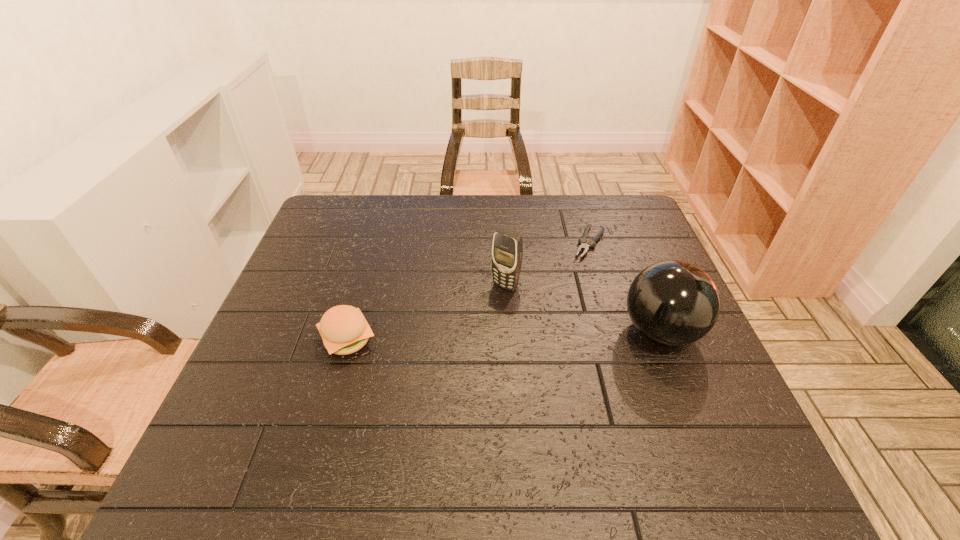
At what (x,y) coordinates should I click in order to perform the action: click on vacant space on the desktop that is between the leftmost object and the bowling ball and is positioned at the gripping part of the farthest object. Please return your answer as a coordinate pair (x, y). Looking at the image, I should click on (537, 335).

Locate an element on the screen. The width and height of the screenshot is (960, 540). vacant space on the desktop that is between the leftmost object and the bowling ball and is positioned on the front face of the cellular telephone is located at coordinates (463, 337).